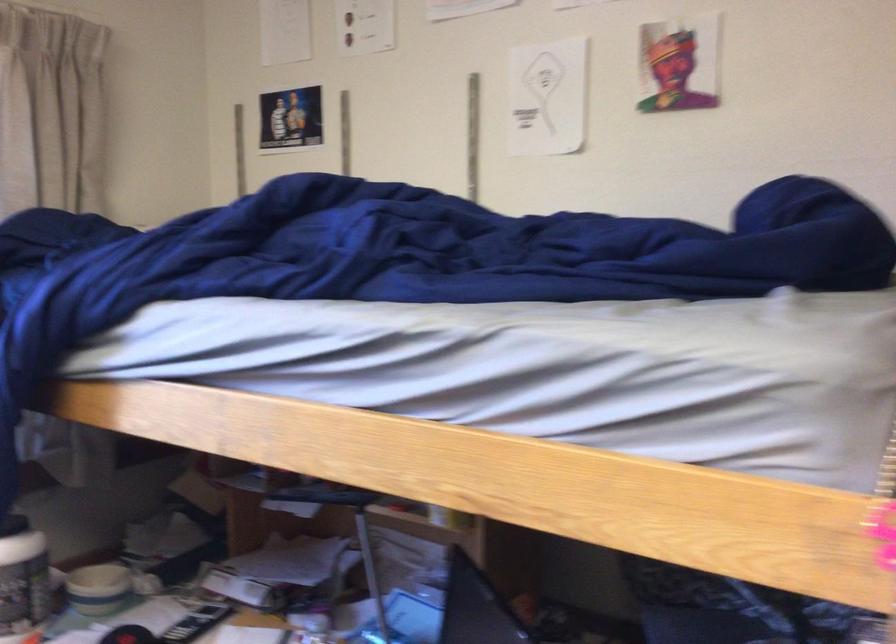
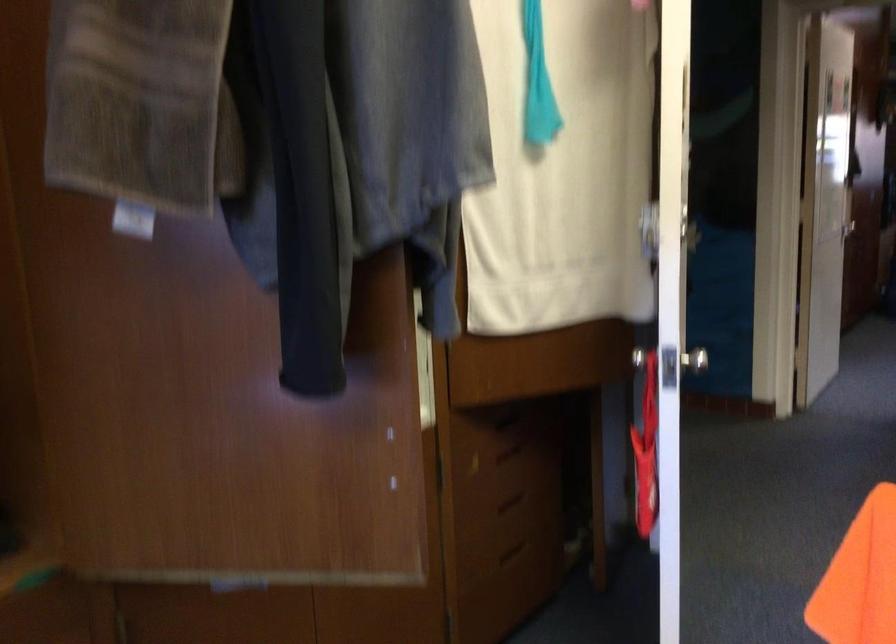
Question: The images are taken continuously from a first-person perspective. In which direction is your viewpoint rotating?

Choices:
 (A) Left
 (B) Right
 (C) Up
 (D) Down

Answer: (B)